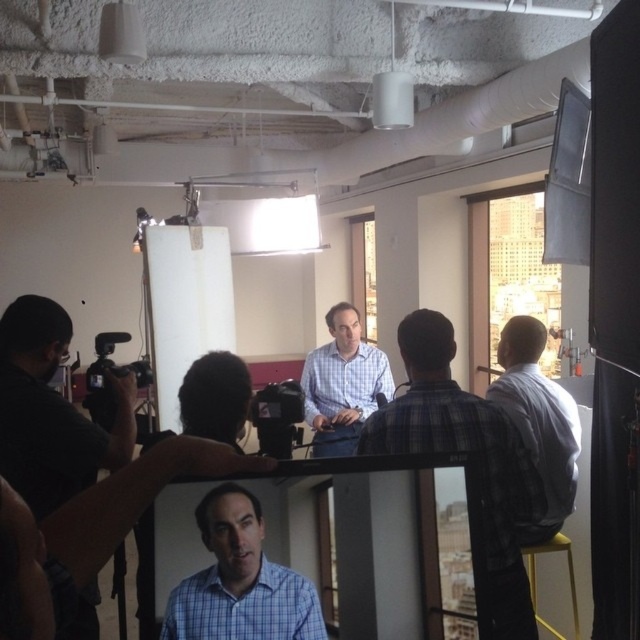
You are standing in the studio and need to locate the plaid shirt at center. According to the coordinates provided, where should you look relative to the center of the image?

The plaid shirt at center is located at coordinates point (465, 452), which means it is positioned slightly to the right and above the center of the image.

You are standing in the studio and want to move from point A to point B. Point A is at coordinate point A, which is point (467, 438), and point B is at coordinate point B, which is point (99, 333). Which point is closer to you when you first arrive at the studio?

Point A at coordinate point (467, 438) is closer to the viewer than point B at coordinate point (99, 333), so point A is closer when you first arrive at the studio.

Consider the image. You are a photographer setting up a shoot in this studio. You need to position a 1.8 meter tall tripod between the plaid shirt at center and the yellow plastic stool at lower right. Can the tripod fit vertically between them without touching either object?

The plaid shirt at center is taller than the yellow plastic stool at lower right. Since the tripod is 1.8 meters tall, it would need to be placed in a position where it doesn not exceed the height of the shorter object, which is the yellow plastic stool at lower right. However, since the stool is shorter than the shirt, the tripod might still be able to stand vertically between them as long as it doesn not extend beyond the height of the stool. But without knowing the exact height of the stool, it is hard.